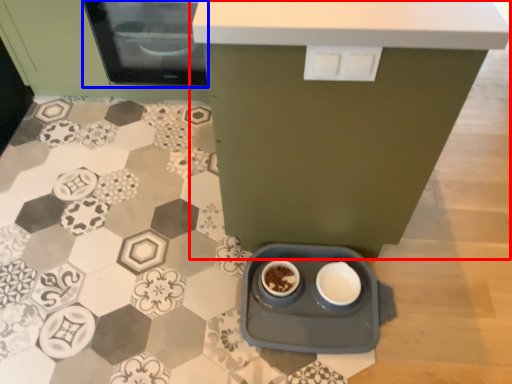
Question: Which of the following is the farthest to the observer, table (highlighted by a red box) or home appliance (highlighted by a blue box)?

Choices:
 (A) table
 (B) home appliance

Answer: (B)